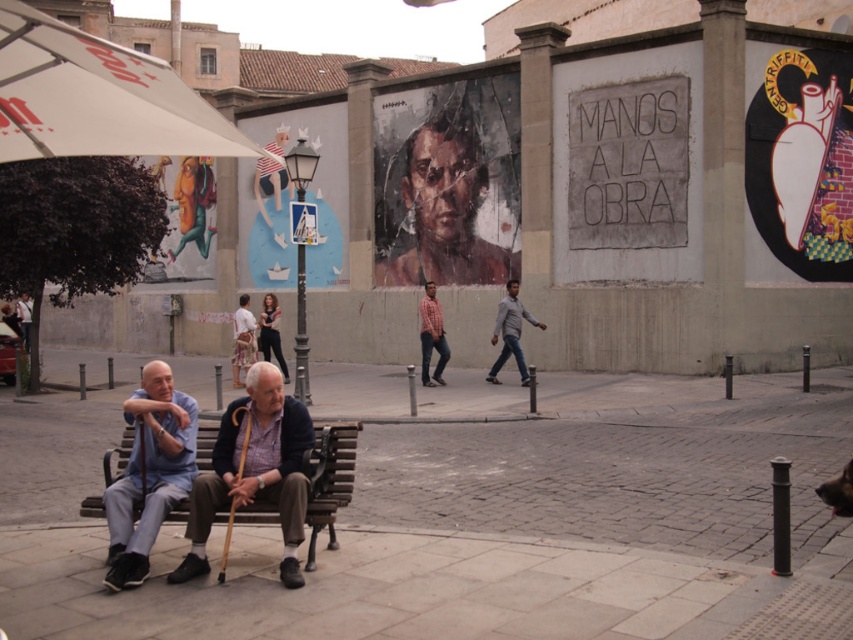
You are standing at the point marked as point (149, 472) in the urban scene. What object is located at this coordinate?

The point (149, 472) corresponds to the light blue shirt at left.

You are a photographer trying to capture the scene of the two men on the bench. You notice the matte black pants at center and the dark blue jeans at center. Which clothing item is positioned higher relative to the other?

The matte black pants at center is located above dark blue jeans at center, so the matte black pants at center is positioned higher than the dark blue jeans at center.

You are a tailor measuring fabric for alterations. You have a piece of fabric that is 1 meter wide. You need to decide which item, the light blue shirt at left or the dark blue jeans at center, can be altered without needing more fabric. Which item would you choose?

The light blue shirt at left is thinner than the dark blue jeans at center, so the light blue shirt at left requires less fabric and can be altered without needing more fabric.